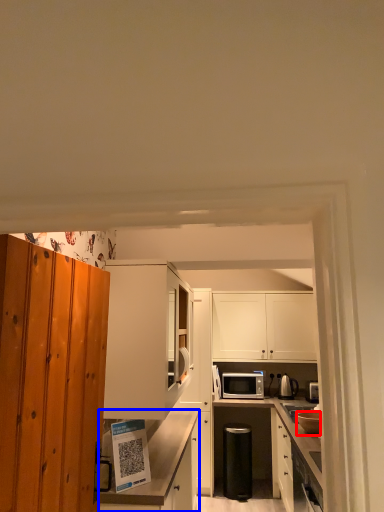
Question: Which of the following is the farthest to the observer, appliance (highlighted by a red box) or cabinetry (highlighted by a blue box)?

Choices:
 (A) appliance
 (B) cabinetry

Answer: (A)